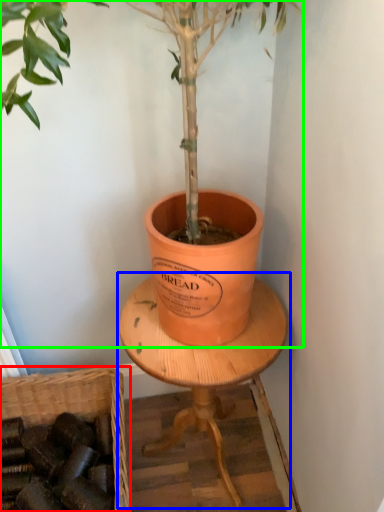
Question: Which object is positioned farthest from basket (highlighted by a red box)? Select from round table (highlighted by a blue box) and houseplant (highlighted by a green box).

Choices:
 (A) round table
 (B) houseplant

Answer: (B)